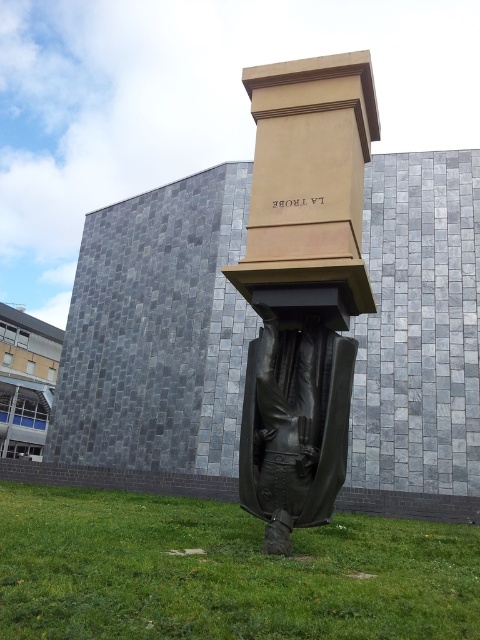
You are a photographer planning to capture the black polished statue at center and the green grass at lower center in a single frame. Based on the scene description, which of the two elements occupies a larger area in the image?

The green grass at lower center occupies a larger area in the image than the black polished statue at center, as its width is greater according to the description.

You are a photographer standing at the base of the sculpture. You want to capture a photo that includes both the green grass at lower center and the black polished statue at center. Based on their positions, where should you position yourself to ensure both elements are visible in the frame?

Since the green grass at lower center is located below the black polished statue at center, you should position yourself at a lower angle or crouch down so that your camera can capture both the grass at the lower part of the frame and the statue centered above it.